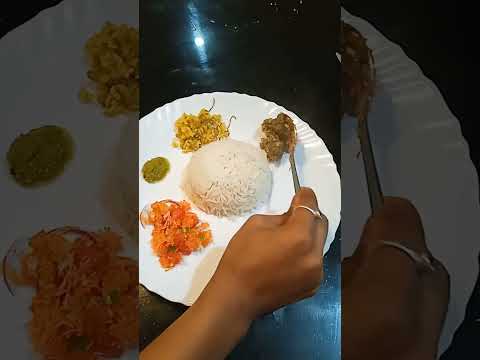
This screenshot has height=360, width=480. In order to click on plate in this screenshot , I will do coord(416,113), coord(316,161).